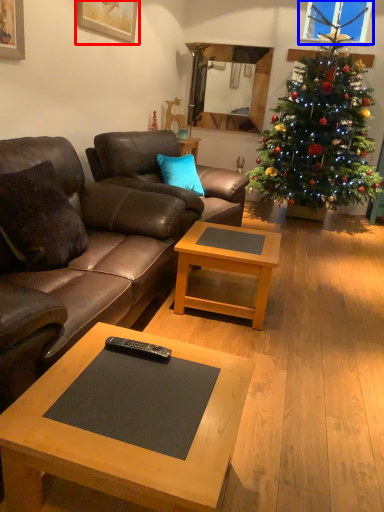
Question: Among these objects, which one is nearest to the camera, picture frame (highlighted by a red box) or window screen (highlighted by a blue box)?

Choices:
 (A) picture frame
 (B) window screen

Answer: (A)